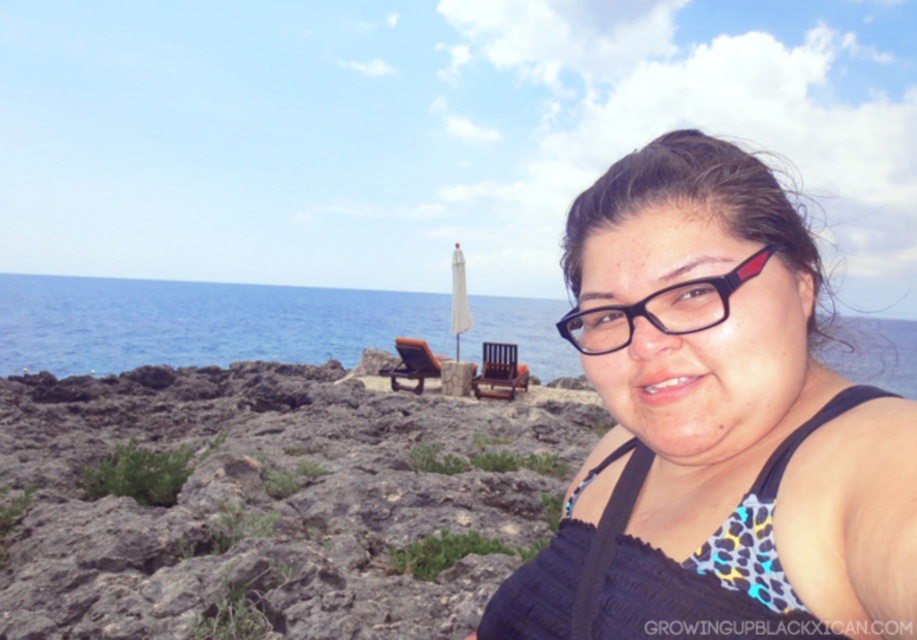
Question: Is black matte swimsuit at center thinner than black plastic glasses at center?

Choices:
 (A) no
 (B) yes

Answer: (A)

Question: Is black matte swimsuit at center behind blue water at center?

Choices:
 (A) yes
 (B) no

Answer: (B)

Question: Based on their relative distances, which object is nearer to the black matte swimsuit at center?

Choices:
 (A) blue water at center
 (B) black plastic glasses at center

Answer: (B)

Question: Is blue water at center positioned at the back of black plastic glasses at center?

Choices:
 (A) yes
 (B) no

Answer: (A)

Question: Which point is farther to the camera?

Choices:
 (A) (379, 301)
 (B) (687, 262)

Answer: (A)

Question: Which point is closer to the camera?

Choices:
 (A) black matte swimsuit at center
 (B) blue water at center
 (C) black plastic glasses at center

Answer: (A)